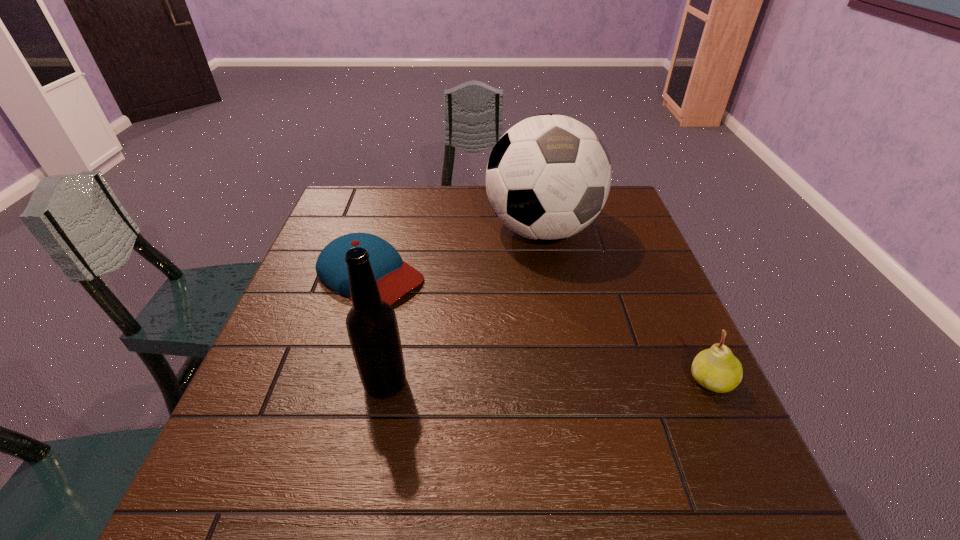
I want to click on vacant area situated 0.350m with the bill of the baseball cap facing forward, so click(527, 374).

Where is `vacant space located with the bill of the baseball cap facing forward`? vacant space located with the bill of the baseball cap facing forward is located at coordinates (422, 307).

Identify the location of vacant space located with the bill of the baseball cap facing forward. (492, 352).

Find the location of a particular element. object situated at the far edge is located at coordinates tap(548, 177).

This screenshot has height=540, width=960. Find the location of `object that is positioned at the left edge`. object that is positioned at the left edge is located at coordinates (394, 277).

Find the location of a particular element. Image resolution: width=960 pixels, height=540 pixels. pear situated at the right edge is located at coordinates (716, 369).

What are the coordinates of `soccer ball at the right edge` in the screenshot? It's located at (548, 177).

Locate an element on the screen. The height and width of the screenshot is (540, 960). object that is at the far right corner is located at coordinates (548, 177).

At what (x,y) coordinates should I click in order to perform the action: click on free space at the far edge of the desktop. Please return your answer as a coordinate pair (x, y). The image size is (960, 540). Looking at the image, I should click on (423, 199).

This screenshot has width=960, height=540. I want to click on free space at the near edge, so click(475, 437).